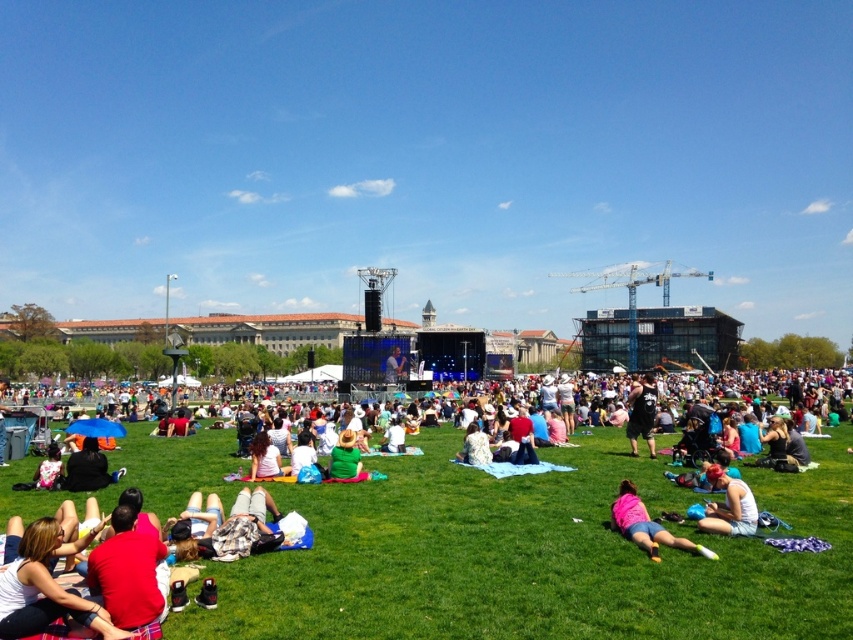
You are attending a festival and want to take a photo of the light pink fabric at center and the white cotton shirt at center. Which one should you focus on if you want to capture the larger object in your shot?

The light pink fabric at center is larger in size than the white cotton shirt at center, so you should focus on the light pink fabric at center to capture the larger object in your shot.

From the picture: You are standing at the center of the field and want to find the matte red shirt at lower left. Which direction should you move to locate it?

The matte red shirt at lower left is located at point (45, 588), so you should move towards the lower left direction to find it.